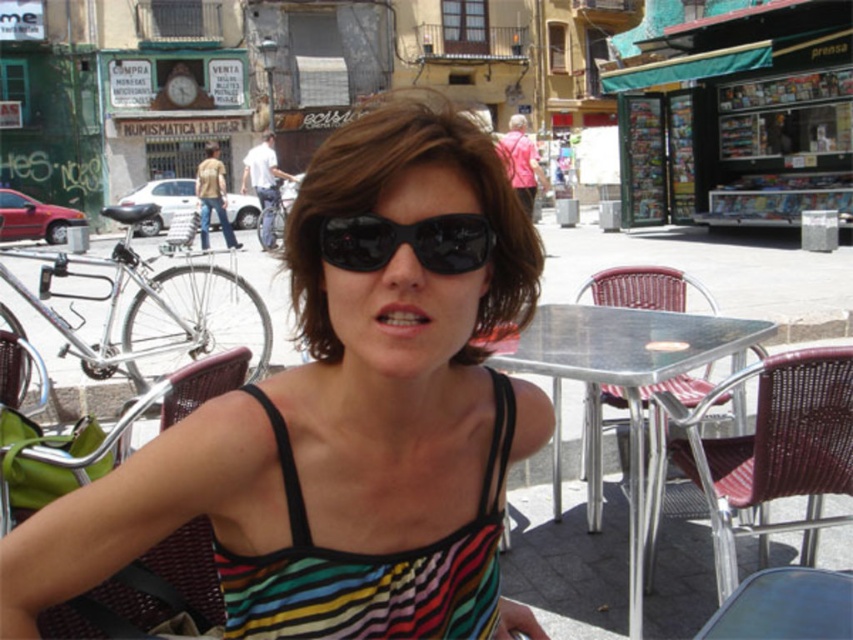
Question: Which point is closer to the camera taking this photo?

Choices:
 (A) (300, 385)
 (B) (241, 560)
 (C) (131, 627)

Answer: (B)

Question: In this image, where is woven brown chair at lower right located relative to metallic silver table at center?

Choices:
 (A) left
 (B) right

Answer: (B)

Question: Which of the following is the farthest from the observer?

Choices:
 (A) woven brown chair at lower right
 (B) metallic silver chair at center
 (C) metallic silver table at center
 (D) striped fabric dress at center

Answer: (B)

Question: Does woven brown chair at lower right lie behind black plastic sunglasses at center?

Choices:
 (A) no
 (B) yes

Answer: (B)

Question: Is metallic silver table at center to the left of black plastic sunglasses at center from the viewer's perspective?

Choices:
 (A) no
 (B) yes

Answer: (A)

Question: Which point is closer to the camera taking this photo?

Choices:
 (A) (436, 237)
 (B) (666, 348)
 (C) (403, 540)

Answer: (A)